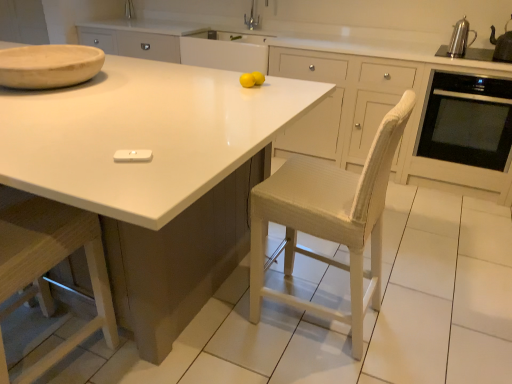
Question: Should I look upward or downward to see silver metallic faucet at upper center?

Choices:
 (A) down
 (B) up

Answer: (B)

Question: From a real-world perspective, is metallic silver kettle at upper right, positioned as the 1th appliance in right-to-left order, located higher than polished stainless steel kettle at upper right?

Choices:
 (A) no
 (B) yes

Answer: (B)

Question: From the image's perspective, is metallic silver kettle at upper right, which is the 2th appliance in left-to-right order, beneath polished stainless steel kettle at upper right?

Choices:
 (A) no
 (B) yes

Answer: (B)

Question: Does metallic silver kettle at upper right, the first appliance in the back-to-front sequence, have a larger size compared to polished stainless steel kettle at upper right?

Choices:
 (A) no
 (B) yes

Answer: (B)

Question: From the image's perspective, is metallic silver kettle at upper right, arranged as the second appliance when ordered from the bottom, located above polished stainless steel kettle at upper right?

Choices:
 (A) no
 (B) yes

Answer: (A)

Question: Can you confirm if metallic silver kettle at upper right, which is the 1th appliance in top-to-bottom order, is smaller than polished stainless steel kettle at upper right?

Choices:
 (A) yes
 (B) no

Answer: (B)

Question: From a real-world perspective, is metallic silver kettle at upper right, positioned as the 1th appliance in right-to-left order, beneath polished stainless steel kettle at upper right?

Choices:
 (A) yes
 (B) no

Answer: (B)

Question: Considering the relative positions of wooden at left and natural wood bowl at upper left in the image provided, is wooden at left to the right of natural wood bowl at upper left from the viewer's perspective?

Choices:
 (A) yes
 (B) no

Answer: (A)

Question: Is wooden at left not close to natural wood bowl at upper left?

Choices:
 (A) no
 (B) yes

Answer: (A)

Question: Is wooden at left thinner than natural wood bowl at upper left?

Choices:
 (A) yes
 (B) no

Answer: (A)

Question: Is wooden at left positioned beyond the bounds of natural wood bowl at upper left?

Choices:
 (A) no
 (B) yes

Answer: (B)

Question: Does wooden at left have a lesser height compared to natural wood bowl at upper left?

Choices:
 (A) yes
 (B) no

Answer: (B)

Question: Considering the relative sizes of wooden at left and natural wood bowl at upper left in the image provided, is wooden at left wider than natural wood bowl at upper left?

Choices:
 (A) no
 (B) yes

Answer: (A)

Question: Is silver metallic faucet at upper center positioned with its back to metallic silver kettle at upper right, the 2th appliance from the front?

Choices:
 (A) no
 (B) yes

Answer: (A)